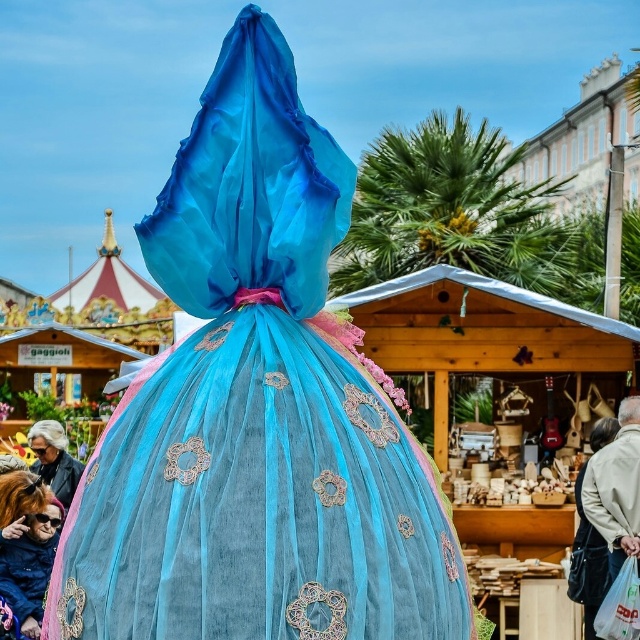
In the scene shown: You are a vendor at the market and want to place your light beige fabric bag at lower right next to the translucent tulle dress at center. Which object will take up more space on the display table?

The light beige fabric bag at lower right takes up more space than the translucent tulle dress at center because the translucent tulle dress at center is smaller than light beige fabric bag at lower right.

You are at the market and want to pick up the light beige fabric bag at lower right without touching the translucent tulle dress at center. Is this possible?

The translucent tulle dress at center is in front of the light beige fabric bag at lower right, so you can reach the bag without touching the dress by moving around or behind the dress.